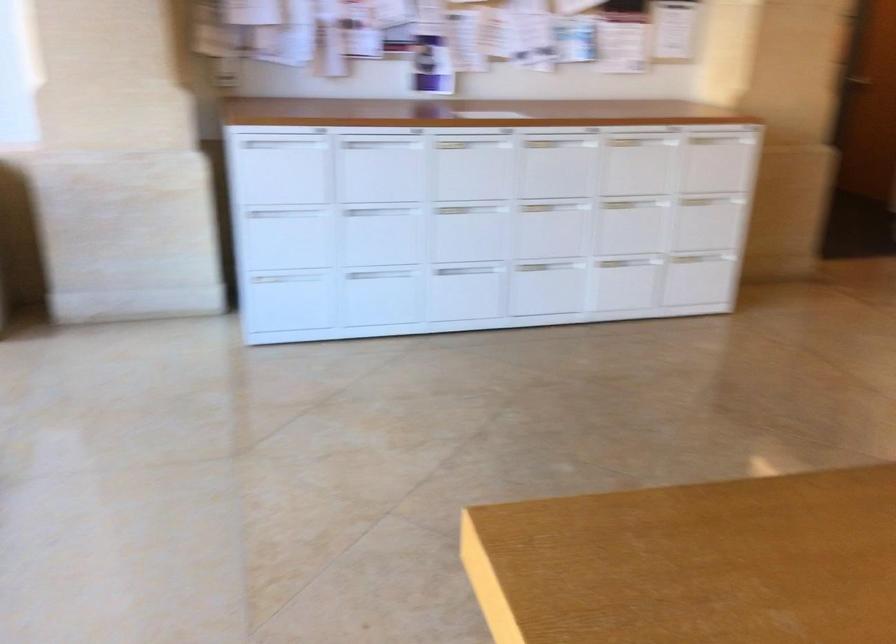
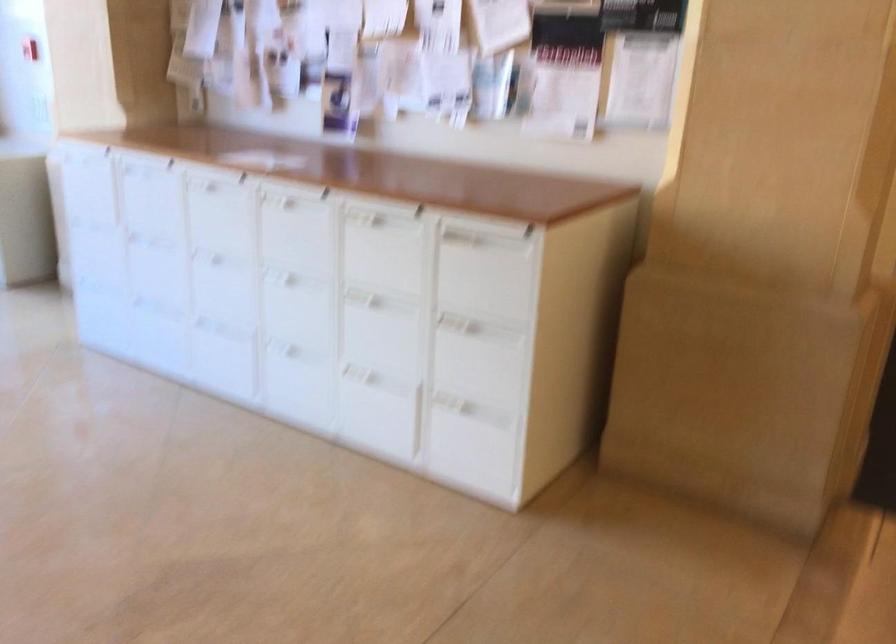
In the second image, find the point that corresponds to point 725,144 in the first image.

(487, 269)